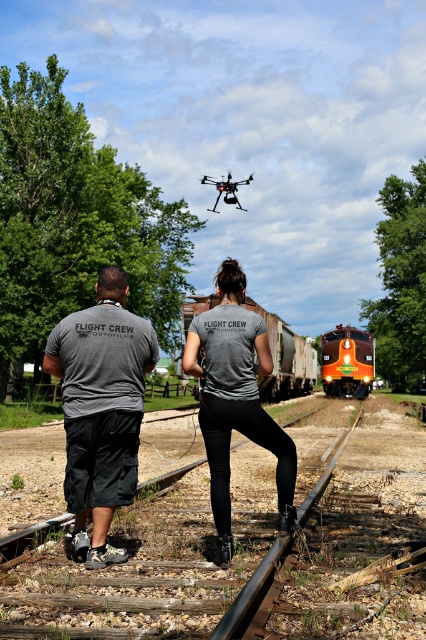
You are a photographer trying to capture the gray matte shirt at center and the black matte drone at center in a single shot. Based on their positions, which object will appear larger in your photo?

The gray matte shirt at center will appear larger in the photo because it is closer to the viewer than the black matte drone at center.